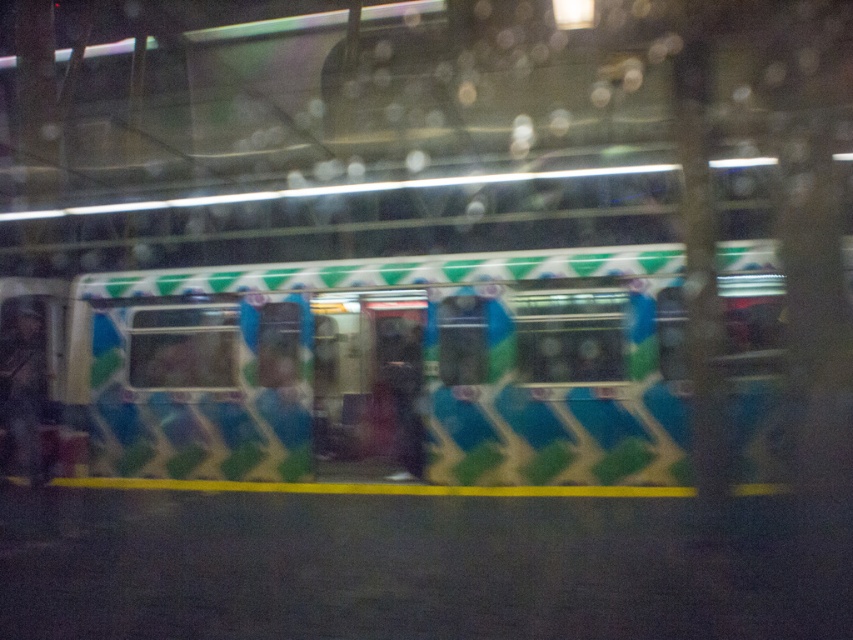
Question: Does matte green and blue train at center lie behind matte blue jacket at left?

Choices:
 (A) yes
 (B) no

Answer: (B)

Question: Which of the following is the farthest from the observer?

Choices:
 (A) (27, 401)
 (B) (669, 435)

Answer: (A)

Question: Observing the image, what is the correct spatial positioning of matte green and blue train at center in reference to matte blue jacket at left?

Choices:
 (A) left
 (B) right

Answer: (B)

Question: In this image, where is matte green and blue train at center located relative to matte blue jacket at left?

Choices:
 (A) right
 (B) left

Answer: (A)

Question: Which of the following is the farthest from the observer?

Choices:
 (A) (1, 362)
 (B) (679, 336)

Answer: (A)